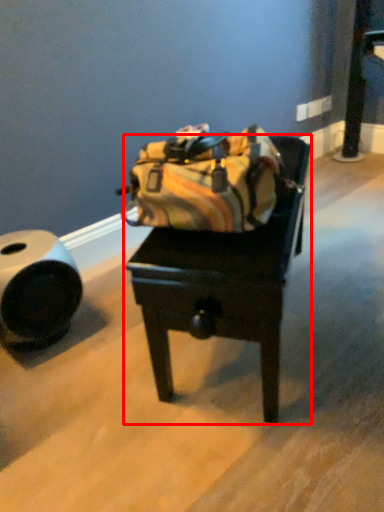
Question: From the image's perspective, considering the relative positions of furniture (annotated by the red box) and tube in the image provided, where is furniture (annotated by the red box) located with respect to the staircase?

Choices:
 (A) below
 (B) above

Answer: (B)